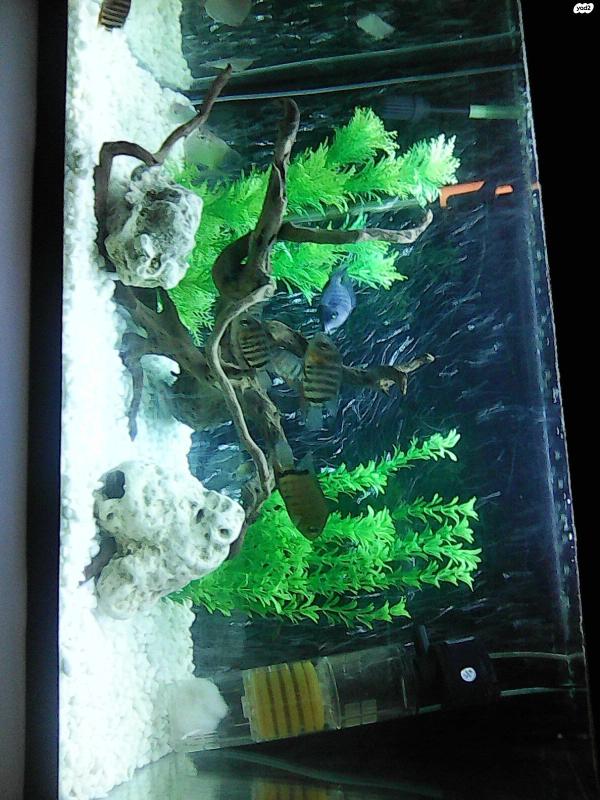
The height and width of the screenshot is (800, 600). Find the location of `bottom of fish tank`. bottom of fish tank is located at coordinates (105, 88).